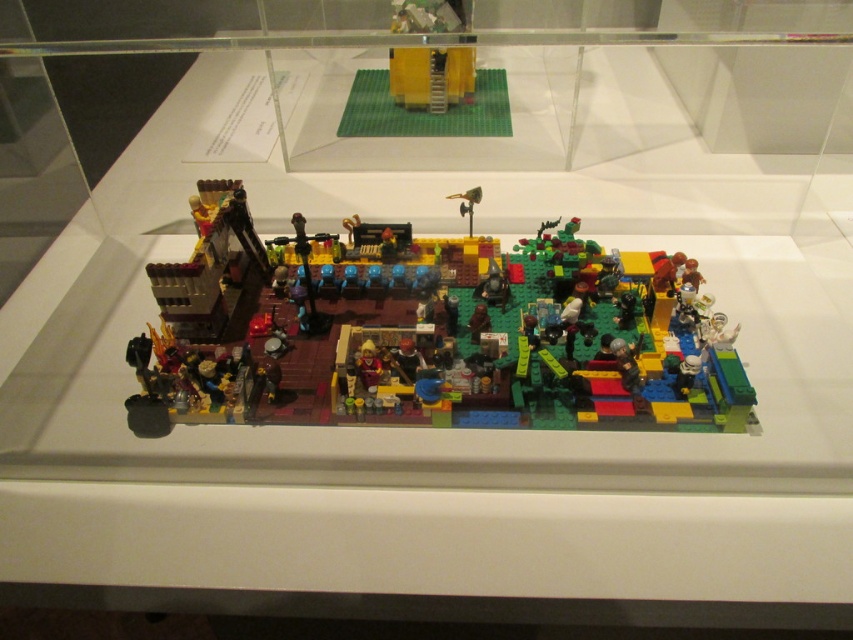
Is multicolored plastic lego set at center bigger than yellow matte building at upper center?

Yes, multicolored plastic lego set at center is bigger than yellow matte building at upper center.

Is multicolored plastic lego set at center in front of yellow matte building at upper center?

Yes.

Is point (448, 273) behind point (430, 10)?

No, (448, 273) is closer to viewer.

At what (x,y) coordinates should I click in order to perform the action: click on multicolored plastic lego set at center. Please return your answer as a coordinate pair (x, y). Looking at the image, I should click on (426, 332).